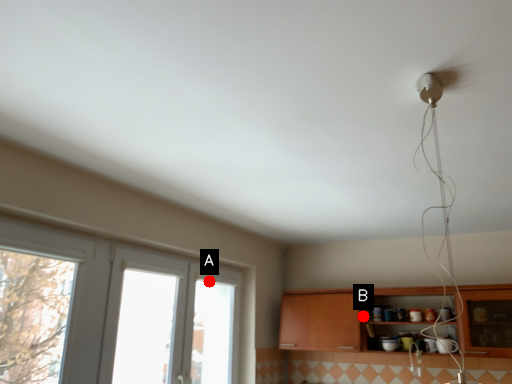
Question: Two points are circled on the image, labeled by A and B beside each circle. Which point appears closest to the camera in this image?

Choices:
 (A) A is closer
 (B) B is closer

Answer: (A)